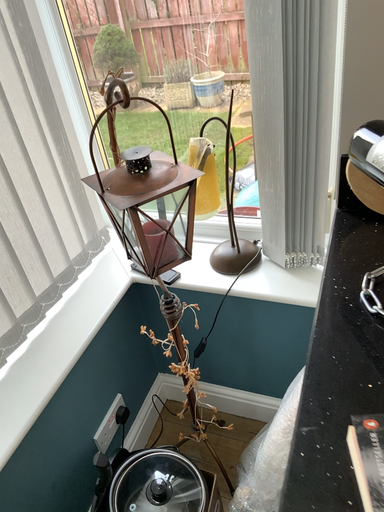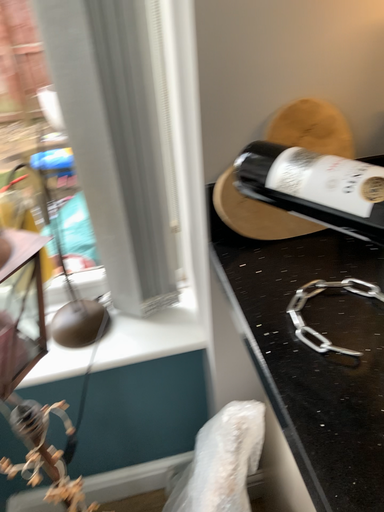
Question: Which way did the camera rotate in the video?

Choices:
 (A) rotated left
 (B) rotated right

Answer: (B)